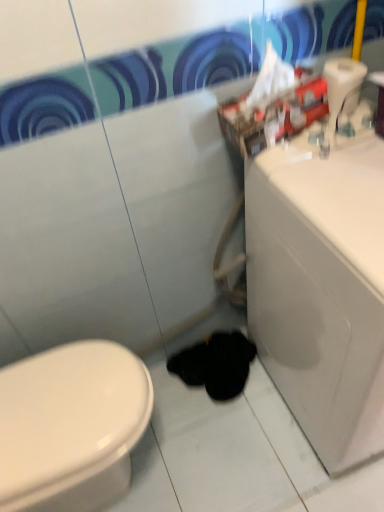
Locate an element on the screen. The height and width of the screenshot is (512, 384). free location above black fuzzy animal at lower center (from a real-world perspective) is located at coordinates (230, 345).